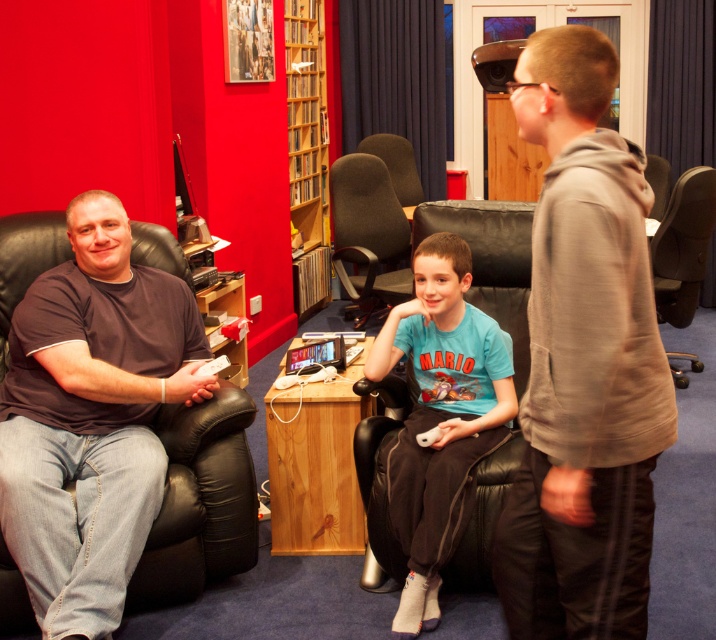
Question: Which object is the closest to the blue cotton shirt at center?

Choices:
 (A) wooden bookshelf at upper center
 (B) dark brown fabric chair at center

Answer: (B)

Question: Is blue cotton shirt at center closer to the viewer compared to wooden bookshelf at upper center?

Choices:
 (A) no
 (B) yes

Answer: (B)

Question: Is dark gray t-shirt at left positioned behind wooden bookshelf at upper center?

Choices:
 (A) no
 (B) yes

Answer: (A)

Question: Which object is closer to the camera taking this photo?

Choices:
 (A) light brown hoodie at right
 (B) wooden bookshelf at upper center
 (C) dark gray t-shirt at left

Answer: (A)

Question: Is blue cotton shirt at center bigger than brown leather swivel chair at right?

Choices:
 (A) no
 (B) yes

Answer: (B)

Question: Which object is the closest to the dark brown fabric chair at center?

Choices:
 (A) blue cotton shirt at center
 (B) light brown hoodie at right
 (C) brown leather swivel chair at right

Answer: (A)